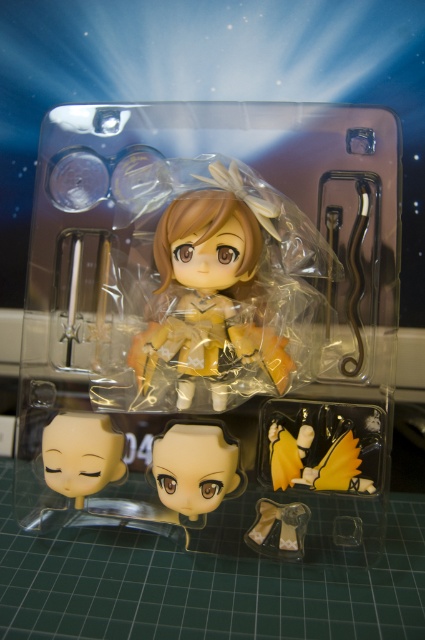
You are a collector examining the packaging of a new figurine. You notice the translucent plastic doll at center and the matte beige fabric skirt at lower center. Which object is positioned closer to you?

The translucent plastic doll at center is closer to the viewer than the matte beige fabric skirt at lower center.

You are examining the packaging of a collectible toy. You notice two points labeled as point 1 and point 2. Point 1 is at coordinate point [278,161] and point 2 is at coordinate point [76,490]. Which point is closer to you when looking at the packaging?

Point 1 is closer to you because it is further to the viewer than point 2.

You are a collector standing 1 meter away from the packaging. Can you clearly see the matte yellow head at lower left without moving closer?

The matte yellow head at lower left is 1.11 meters away from the viewer. Since you are standing 1 meter away, you can clearly see it without needing to move closer.